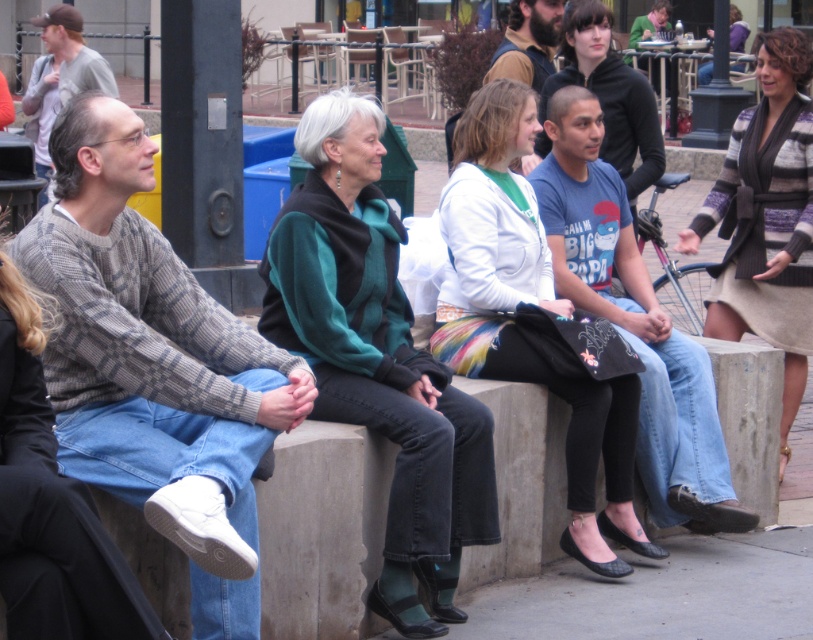
Question: Considering the relative positions of striped knit sweater at center and green sweater at center in the image provided, where is striped knit sweater at center located with respect to green sweater at center?

Choices:
 (A) left
 (B) right

Answer: (B)

Question: Can you confirm if teal knit sweater at center is positioned to the left of matte black hoodie at center?

Choices:
 (A) no
 (B) yes

Answer: (B)

Question: Which point is farther to the camera?

Choices:
 (A) bearded man at center
 (B) matte black hoodie at center

Answer: (A)

Question: Which point is closer to the camera?

Choices:
 (A) teal knit sweater at center
 (B) bearded man at center

Answer: (A)

Question: Can you confirm if green sweater at center is bigger than bearded man at center?

Choices:
 (A) no
 (B) yes

Answer: (B)

Question: Among these objects, which one is farthest from the camera?

Choices:
 (A) bearded man at center
 (B) white textured sweater at center

Answer: (A)